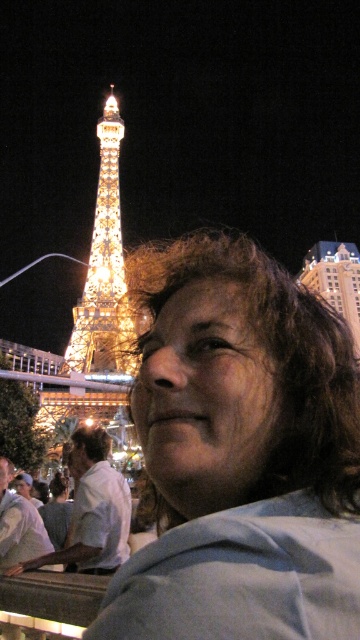
Question: Which point appears closest to the camera in this image?

Choices:
 (A) (110, 282)
 (B) (340, 264)
 (C) (60, 557)

Answer: (C)

Question: Is illuminated glass eiffel tower at upper left bigger than white cotton shirt at center?

Choices:
 (A) yes
 (B) no

Answer: (A)

Question: Estimate the real-world distances between objects in this image. Which object is farther from the white cotton shirt at center?

Choices:
 (A) golden glass tower at upper center
 (B) illuminated glass eiffel tower at upper left

Answer: (A)

Question: Is the position of white cotton shirt at center less distant than that of golden glass tower at upper center?

Choices:
 (A) yes
 (B) no

Answer: (B)

Question: Can you confirm if white cotton shirt at center is smaller than golden glass tower at upper center?

Choices:
 (A) yes
 (B) no

Answer: (A)

Question: Which point is farther from the camera taking this photo?

Choices:
 (A) (81, 516)
 (B) (312, 272)
 (C) (83, 305)

Answer: (B)